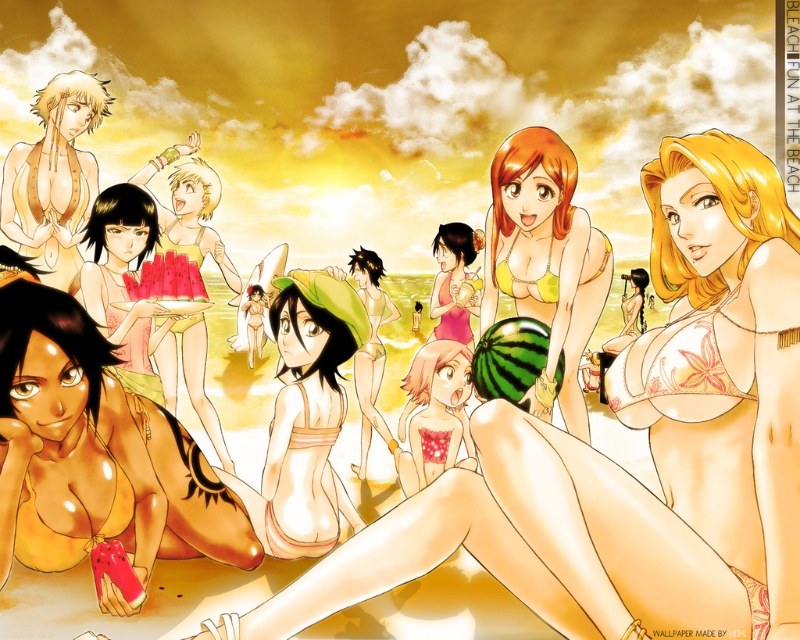
Question: Which object is the closest to the matte yellow bikini at center?

Choices:
 (A) matte orange bikini at lower left
 (B) matte green bikini at center

Answer: (A)

Question: Which point is farther to the camera?

Choices:
 (A) (458, 221)
 (B) (57, 372)

Answer: (A)

Question: Is yellow-green bikini at center bigger than matte pink bikini at center?

Choices:
 (A) yes
 (B) no

Answer: (B)

Question: Considering the real-world distances, which object is farthest from the pink fabric dress at center?

Choices:
 (A) yellow-green bikini at center
 (B) matte pink bikini at center
 (C) matte green bikini at center

Answer: (C)

Question: From the image, what is the correct spatial relationship of matte yellow bikini at center in relation to matte orange bikini at lower left?

Choices:
 (A) above
 (B) below

Answer: (A)

Question: Does matte yellow bikini at left appear on the right side of matte pink bikini at center?

Choices:
 (A) yes
 (B) no

Answer: (B)